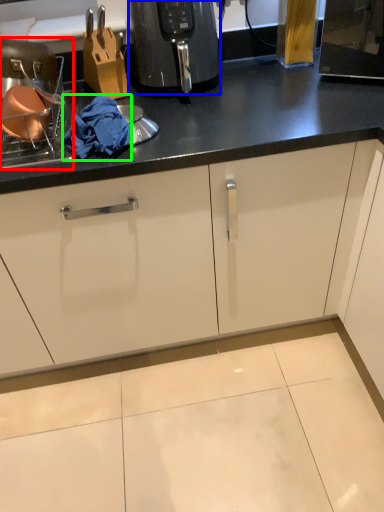
Question: Which object is the farthest from appliance (highlighted by a red box)? Choose among these: home appliance (highlighted by a blue box) or material (highlighted by a green box).

Choices:
 (A) home appliance
 (B) material

Answer: (A)